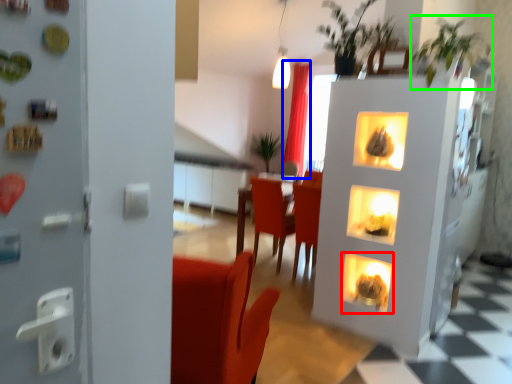
Question: Which object is the farthest from fireplace (highlighted by a red box)? Choose among these: curtain (highlighted by a blue box) or plant (highlighted by a green box).

Choices:
 (A) curtain
 (B) plant

Answer: (A)